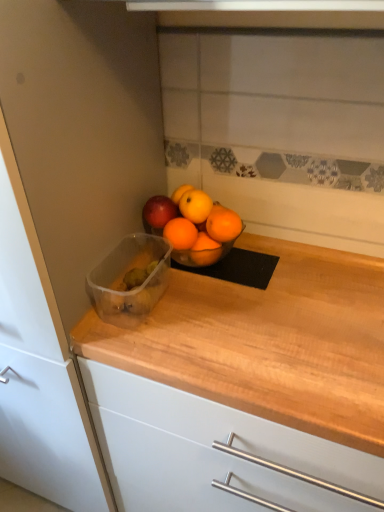
Where is `vacant area located to the right-hand side of transparent plastic container at center`? This screenshot has width=384, height=512. vacant area located to the right-hand side of transparent plastic container at center is located at coordinates (220, 298).